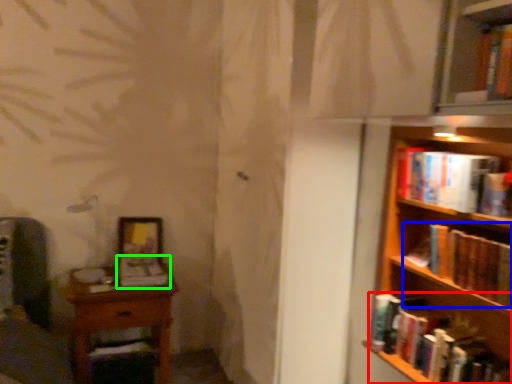
Question: Which object is positioned closest to book (highlighted by a red box)? Select from book (highlighted by a blue box) and book (highlighted by a green box).

Choices:
 (A) book
 (B) book

Answer: (A)